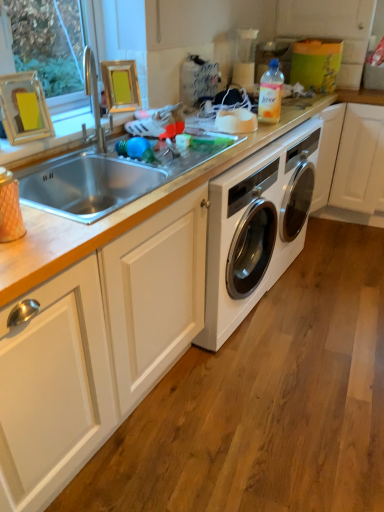
Question: Considering the positions of point (211, 343) and point (266, 120), is point (211, 343) closer or farther from the camera than point (266, 120)?

Choices:
 (A) closer
 (B) farther

Answer: (A)

Question: Relative to translucent plastic bottle at upper right, is white glossy washing machine at center in front or behind?

Choices:
 (A) front
 (B) behind

Answer: (B)

Question: Which object is positioned closest to the white glossy washing machine at center?

Choices:
 (A) white matte cabinet at center
 (B) translucent plastic bottle at upper right
 (C) silver metallic sink at upper left

Answer: (A)

Question: Considering the real-world distances, which object is closest to the white matte cabinet at center?

Choices:
 (A) white glossy washing machine at center
 (B) silver metallic sink at upper left
 (C) translucent plastic bottle at upper right

Answer: (B)